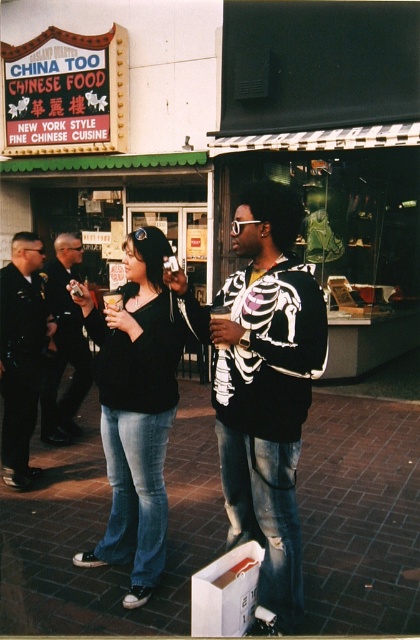
You are a photographer trying to capture a clear shot of the black matte shirt at center and the denim jeans at center. Since the camera has a limited focus range, you need to know which item is wider to adjust the lens properly. Which one is wider?

The black matte shirt at center might be wider than denim jeans at center, so you should adjust the lens to focus on the black matte shirt at center for better clarity.